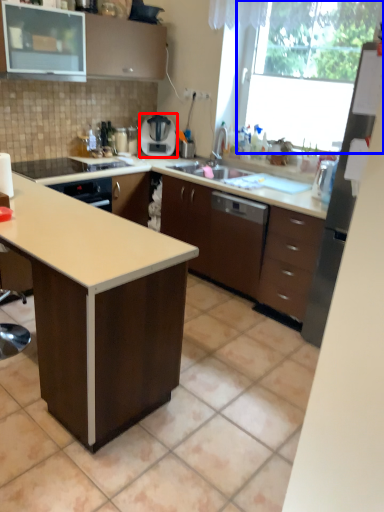
Question: Which object is closer to the camera taking this photo, home appliance (highlighted by a red box) or window screen (highlighted by a blue box)?

Choices:
 (A) home appliance
 (B) window screen

Answer: (B)